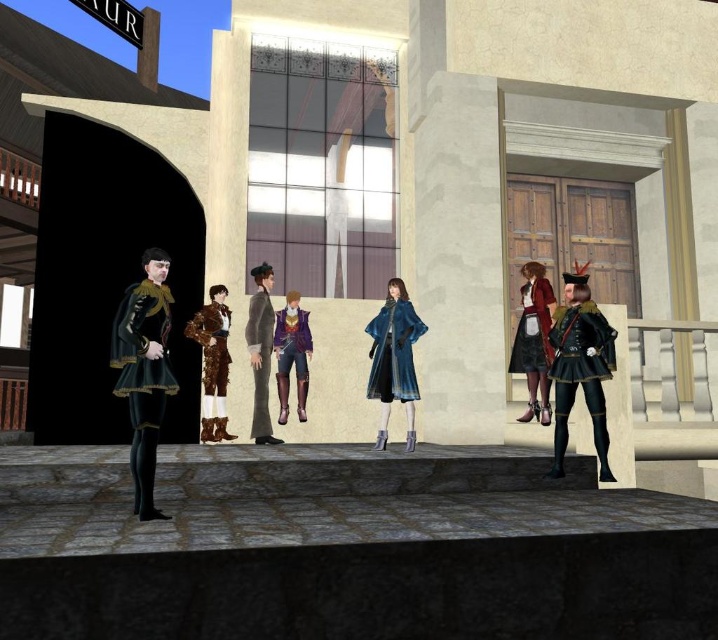
You are a character in this scene and want to move from your current position to the shiny gold armor at center without stepping off the platform. Which direction should you move relative to the velvet black cape at left?

Since the velvet black cape at left is closer to the viewer than the shiny gold armor at center, you should move away from the velvet black cape at left towards the back of the platform to reach the shiny gold armor at center.

You are a character in this scene and want to approach the gray fabric suit at center without stepping on the leather jacket at center. Since both are at the center, can you walk around them on the sides?

The leather jacket at center is further to the viewer than the gray fabric suit at center, so you can walk around them on the sides by moving behind the leather jacket at center and in front of the gray fabric suit at center.